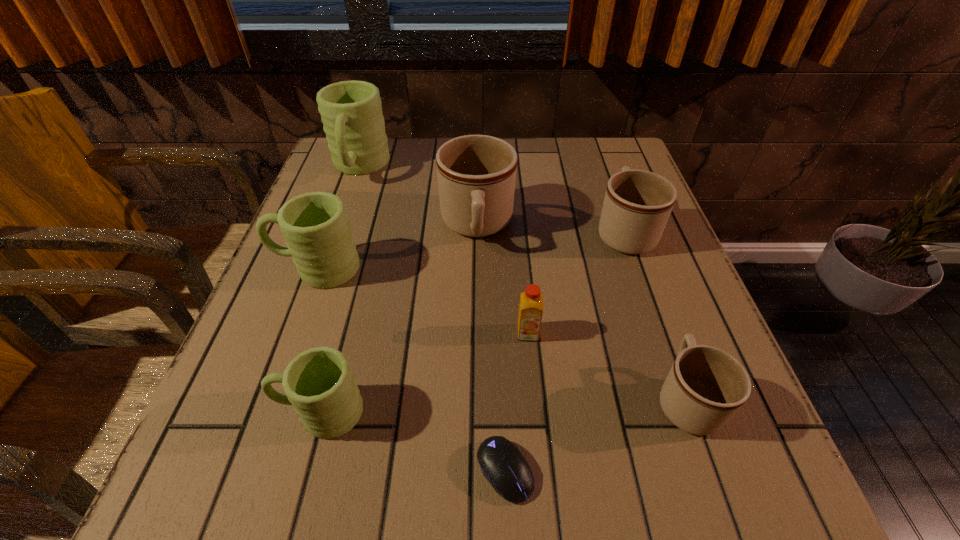
Where is `computer mouse`? This screenshot has height=540, width=960. computer mouse is located at coordinates (502, 463).

Find the location of a particular element. This screenshot has height=540, width=960. free point located on the side of the biggest green mug with the handle is located at coordinates (334, 240).

Where is `vacant region located 0.150m on the side of the third mug from right to left with the handle`? This screenshot has width=960, height=540. vacant region located 0.150m on the side of the third mug from right to left with the handle is located at coordinates (476, 316).

This screenshot has width=960, height=540. What are the coordinates of `blank area located 0.140m on the side of the second smallest brown mug with the handle` in the screenshot? It's located at (605, 175).

The width and height of the screenshot is (960, 540). I want to click on vacant space located 0.050m on the side of the second smallest brown mug with the handle, so click(612, 195).

This screenshot has height=540, width=960. I want to click on free location located 0.280m on the side of the second smallest brown mug with the handle, so click(595, 147).

Find the location of `free space located 0.080m on the front and back of the orange juice`. free space located 0.080m on the front and back of the orange juice is located at coordinates (533, 382).

You are a GUI agent. You are given a task and a screenshot of the screen. Output one action in this format:
    pyautogui.click(x=<x>, y=<y>)
    Task: Click on the vacant space located 0.060m on the side of the nearest green mug with the handle
    
    Given the screenshot: What is the action you would take?
    pyautogui.click(x=239, y=411)

This screenshot has height=540, width=960. What are the coordinates of `free spot located on the side of the nearest green mug with the handle` in the screenshot? It's located at (214, 411).

At what (x,y) coordinates should I click in order to perform the action: click on vacant space located 0.170m on the side of the nearest brown mug with the handle. Please return your answer as a coordinate pair (x, y). This screenshot has width=960, height=540. Looking at the image, I should click on (647, 289).